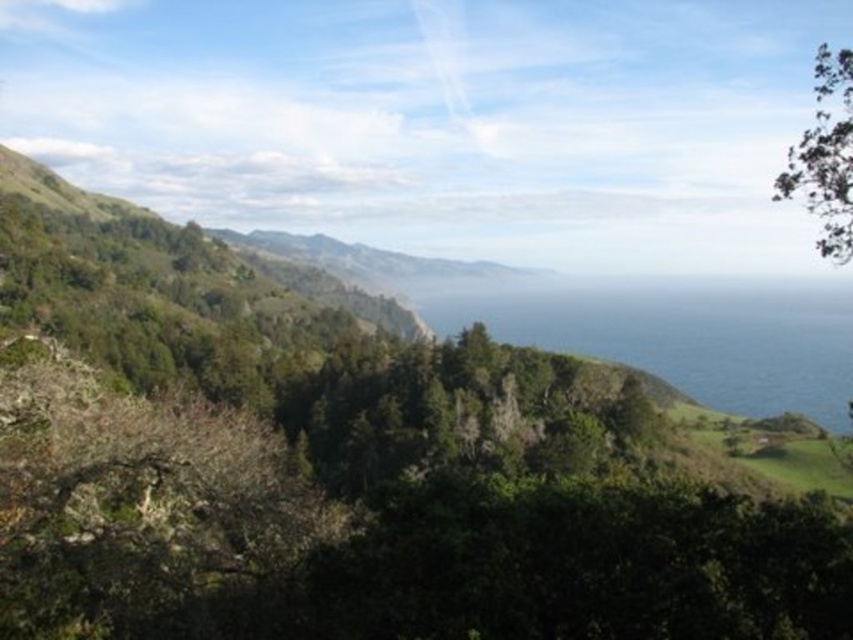
Does point (766, 330) lie in front of point (817, 52)?

No, it is not.

Who is lower down, blue liquid at center or green leafy tree at upper right?

blue liquid at center is lower down.

The width and height of the screenshot is (853, 640). In order to click on blue liquid at center in this screenshot , I will do `click(683, 333)`.

Locate an element on the screen. blue liquid at center is located at coordinates (683, 333).